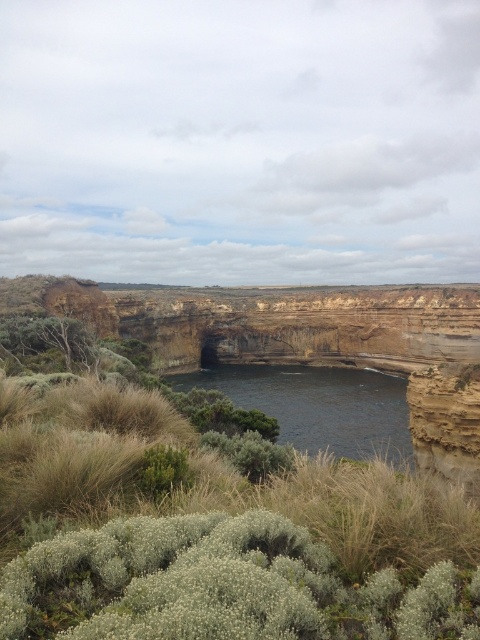
Question: Can you confirm if green grassy shrubs at center is positioned below dark blue water at center?

Choices:
 (A) no
 (B) yes

Answer: (A)

Question: Which point is closer to the camera?

Choices:
 (A) green grassy shrubs at center
 (B) dark blue water at center

Answer: (A)

Question: Observing the image, what is the correct spatial positioning of green grassy shrubs at center in reference to dark blue water at center?

Choices:
 (A) left
 (B) right

Answer: (A)

Question: Can you confirm if green grassy shrubs at center is positioned to the right of dark blue water at center?

Choices:
 (A) yes
 (B) no

Answer: (B)